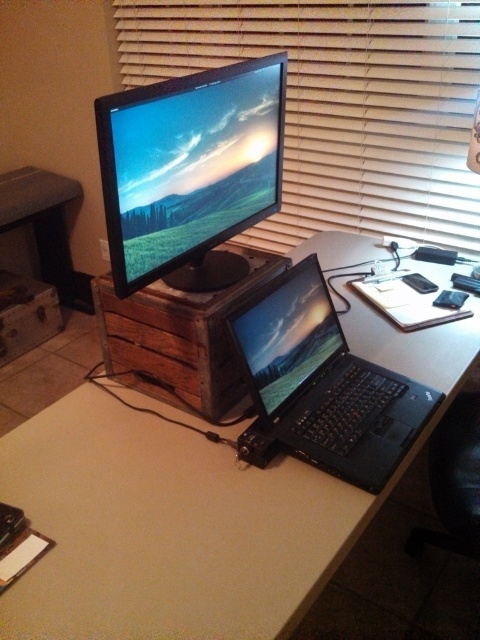
You are organizing your desk and need to place a 3.5 feet long cable between the wooden blind at upper center and the glossy plastic laptop at center. Can the cable reach both objects without bending or stretching?

The distance between the wooden blind at upper center and the glossy plastic laptop at center is 3.44 feet, which is slightly shorter than the 3.5 feet cable. The cable can reach both objects without bending or stretching, but there will be a small amount of slack remaining.

You are standing in front of the workspace and want to place a small object on the desk. You have two options for placement based on the coordinates given. Which coordinate point, point (x=332, y=490) or point (x=116, y=20), is closer to you?

Point (x=332, y=490) is closer to the viewer than point (x=116, y=20).